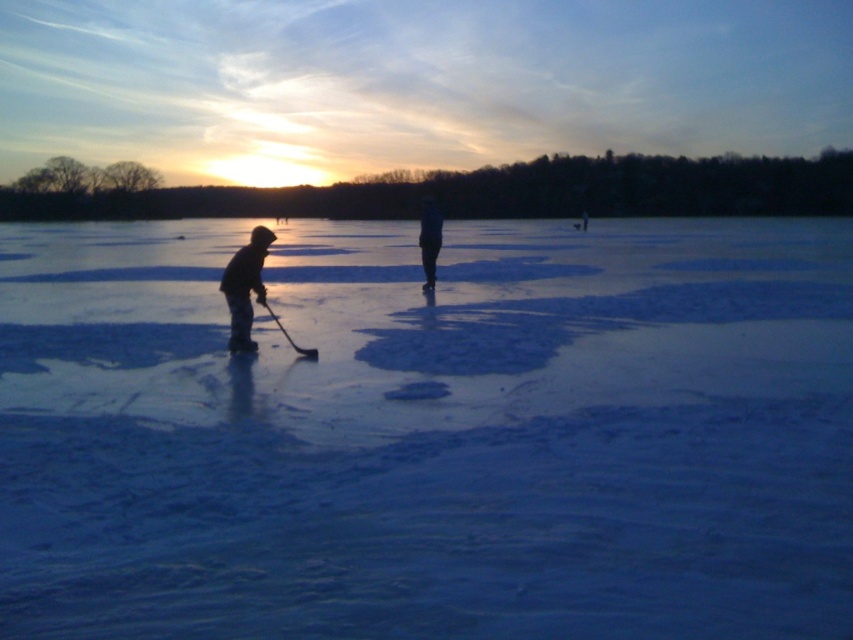
You are standing at the edge of the frozen lake in the winter sunset scene. You see the white matte ice at center and the dark blue jeans at center. Which object is nearer to you?

The white matte ice at center is closer to the viewer than the dark blue jeans at center.

You are an ice hockey player who wants to slide a puck from the white matte ice at center to the shiny black hockey stick at center. Which direction should you push the puck to make it move towards the hockey stick?

You should push the puck to the right because the white matte ice at center is to the left of the shiny black hockey stick at center, so moving right would align it towards the stick.